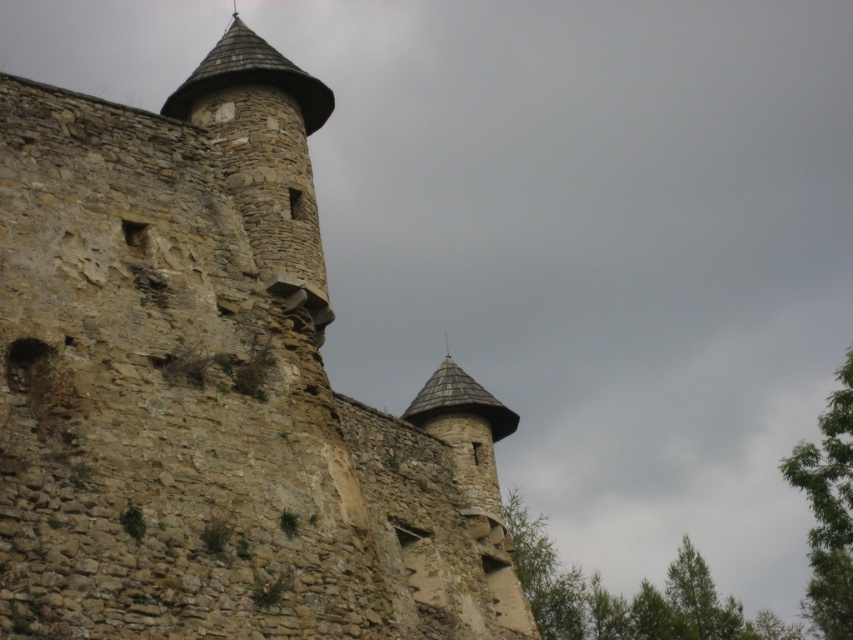
Does rustic stone tower at upper left have a lesser width compared to green leafy tree at upper center?

Indeed, rustic stone tower at upper left has a lesser width compared to green leafy tree at upper center.

Is point (109, 428) less distant than point (581, 589)?

Yes, point (109, 428) is closer to viewer.

I want to click on rustic stone tower at upper left, so click(x=213, y=388).

Which is below, green leafy tree at upper center or green leafy tree at right?

green leafy tree at upper center

Is green leafy tree at upper center to the right of green leafy tree at right from the viewer's perspective?

In fact, green leafy tree at upper center is to the left of green leafy tree at right.

The image size is (853, 640). In order to click on green leafy tree at upper center in this screenshot , I will do `click(625, 596)`.

Does rustic stone tower at upper left have a larger size compared to green leafy tree at right?

No, rustic stone tower at upper left is not bigger than green leafy tree at right.

This screenshot has height=640, width=853. Describe the element at coordinates (213, 388) in the screenshot. I see `rustic stone tower at upper left` at that location.

Where is `rustic stone tower at upper left`? rustic stone tower at upper left is located at coordinates (213, 388).